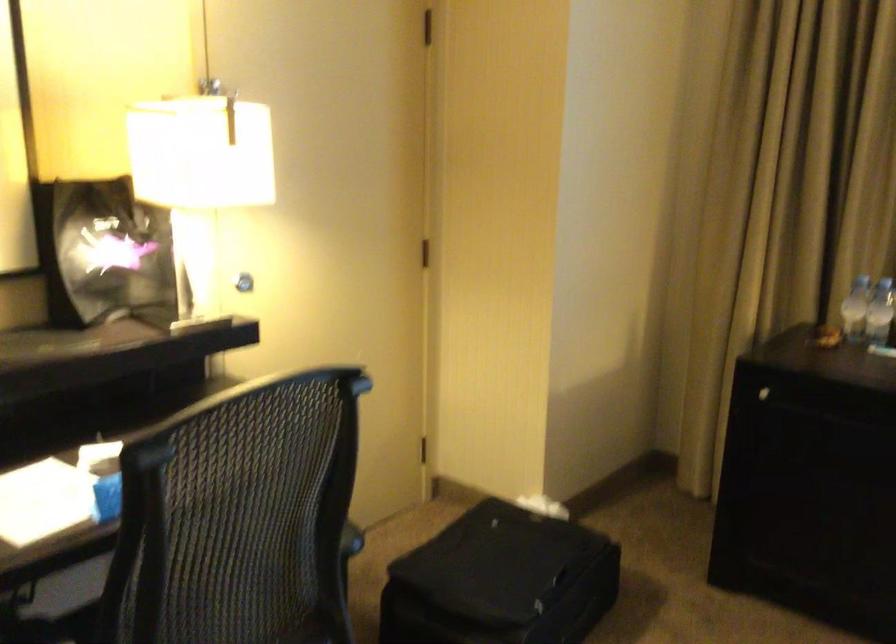
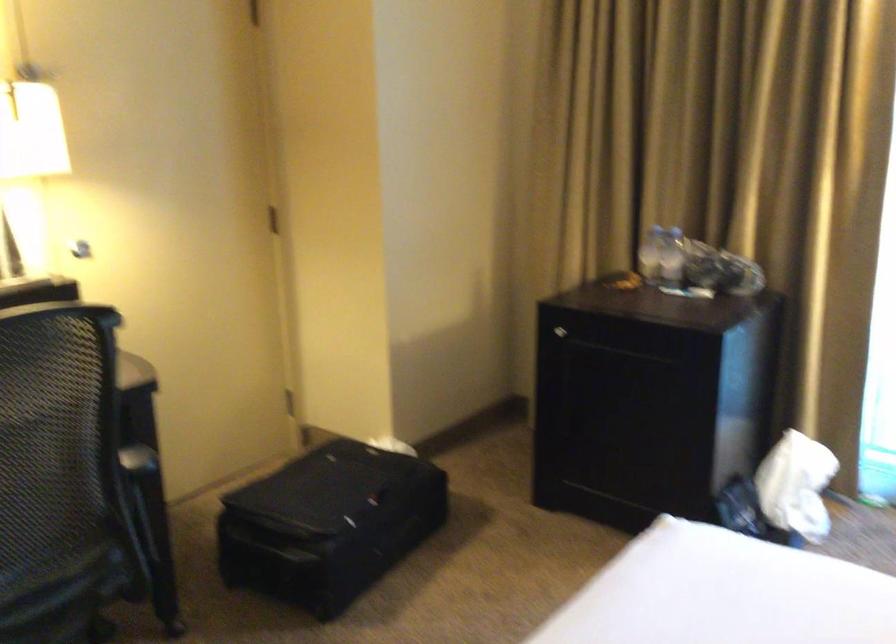
Which direction would the cameraman need to move to produce the second image?

The cameraman moved toward right, backward.